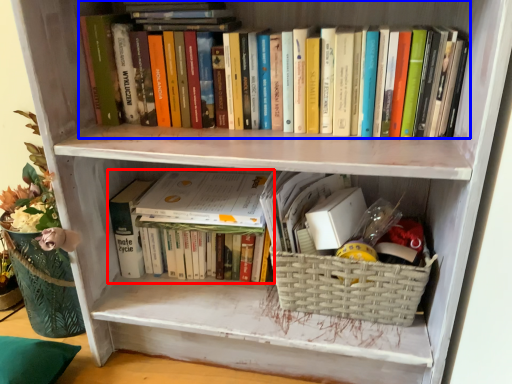
Question: Which object appears closest to the camera in this image, book (highlighted by a red box) or book (highlighted by a blue box)?

Choices:
 (A) book
 (B) book

Answer: (B)